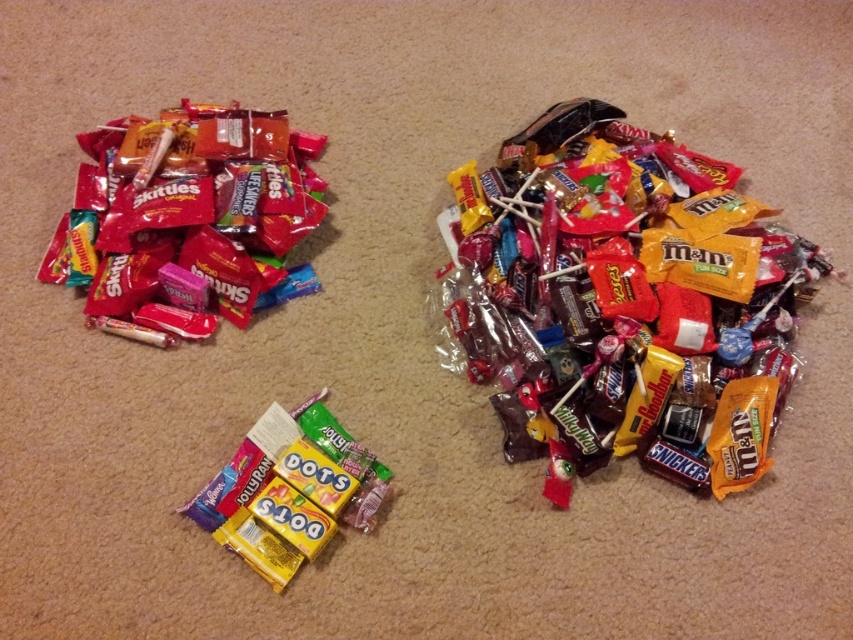
Question: Where is shiny plastic skittles at upper left located in relation to yellow matte dots at center in the image?

Choices:
 (A) left
 (B) right

Answer: (A)

Question: Is shiny chocolate bar at center above shiny plastic skittles at upper left?

Choices:
 (A) no
 (B) yes

Answer: (A)

Question: Which is farther from the shiny plastic skittles at upper left?

Choices:
 (A) yellow matte dots at center
 (B) shiny chocolate bar at center

Answer: (B)

Question: Which object is the closest to the shiny chocolate bar at center?

Choices:
 (A) yellow matte dots at center
 (B) shiny plastic skittles at upper left

Answer: (A)

Question: Which point is closer to the camera taking this photo?

Choices:
 (A) (158, 296)
 (B) (642, 358)

Answer: (B)

Question: Is shiny chocolate bar at center below yellow matte dots at center?

Choices:
 (A) yes
 (B) no

Answer: (B)